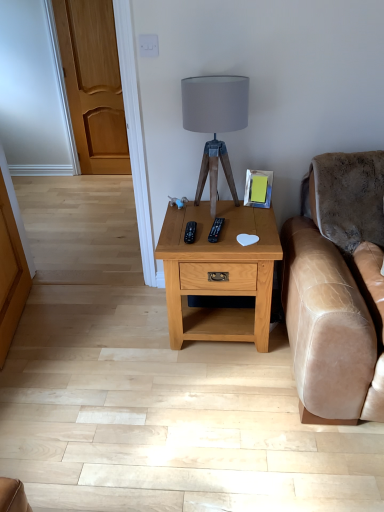
Question: Which direction should I rotate to look at black plastic remote at center, the 1th remote in the right-to-left sequence, — up or down?

Choices:
 (A) up
 (B) down

Answer: (A)

Question: Does black plastic remote at center, acting as the first remote starting from the left, have a greater width compared to light brown wood nightstand at center?

Choices:
 (A) yes
 (B) no

Answer: (B)

Question: Is black plastic remote at center, which is counted as the second remote, starting from the right, facing away from light brown wood nightstand at center?

Choices:
 (A) no
 (B) yes

Answer: (A)

Question: From the image's perspective, is black plastic remote at center, acting as the first remote starting from the left, beneath light brown wood nightstand at center?

Choices:
 (A) yes
 (B) no

Answer: (B)

Question: Considering the relative positions of black plastic remote at center, which is counted as the second remote, starting from the right, and light brown wood nightstand at center in the image provided, is black plastic remote at center, which is counted as the second remote, starting from the right, to the left of light brown wood nightstand at center from the viewer's perspective?

Choices:
 (A) yes
 (B) no

Answer: (A)

Question: Can you confirm if black plastic remote at center, which is counted as the second remote, starting from the right, is taller than light brown wood nightstand at center?

Choices:
 (A) no
 (B) yes

Answer: (A)

Question: From a real-world perspective, is black plastic remote at center, which is counted as the second remote, starting from the right, below light brown wood nightstand at center?

Choices:
 (A) no
 (B) yes

Answer: (A)

Question: Considering the relative sizes of black plastic remote at center, the 2th remote from the left, and light brown wood nightstand at center in the image provided, is black plastic remote at center, the 2th remote from the left, shorter than light brown wood nightstand at center?

Choices:
 (A) no
 (B) yes

Answer: (B)

Question: From a real-world perspective, is black plastic remote at center, the 2th remote from the left, physically below light brown wood nightstand at center?

Choices:
 (A) no
 (B) yes

Answer: (A)

Question: Is black plastic remote at center, the 1th remote in the right-to-left sequence, closer to the viewer compared to light brown wood nightstand at center?

Choices:
 (A) yes
 (B) no

Answer: (B)

Question: Is black plastic remote at center, the 2th remote from the left, facing towards light brown wood nightstand at center?

Choices:
 (A) yes
 (B) no

Answer: (B)

Question: Is black plastic remote at center, the 2th remote from the left, taller than light brown wood nightstand at center?

Choices:
 (A) yes
 (B) no

Answer: (B)

Question: Can we say black plastic remote at center, the 1th remote in the right-to-left sequence, lies outside light brown wood nightstand at center?

Choices:
 (A) no
 (B) yes

Answer: (A)

Question: Can you see light brown wood nightstand at center touching matte gray fabric lampshade at center?

Choices:
 (A) no
 (B) yes

Answer: (A)